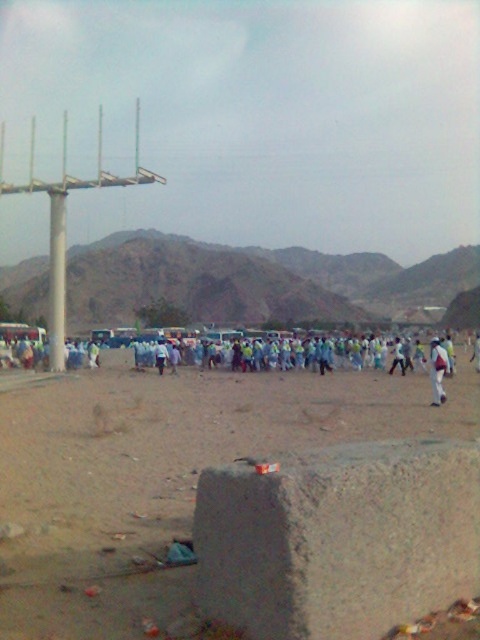
Between brown sandy dirt at center and white concrete pillar at left, which one appears on the left side from the viewer's perspective?

From the viewer's perspective, white concrete pillar at left appears more on the left side.

Find the location of a particular element. brown sandy dirt at center is located at coordinates (164, 476).

Find the location of `brown sandy dirt at center`. brown sandy dirt at center is located at coordinates (164, 476).

Can you confirm if white concrete pillar at left is shorter than white fabric person at center?

Incorrect, white concrete pillar at left's height does not fall short of white fabric person at center's.

Which is more to the right, white concrete pillar at left or white fabric person at center?

white fabric person at center

Is point (61, 310) closer to viewer compared to point (399, 364)?

No.

The width and height of the screenshot is (480, 640). I want to click on white concrete pillar at left, so click(57, 278).

Which is in front, point (62, 346) or point (447, 365)?

Point (447, 365) is more forward.

Does white concrete pillar at left appear on the right side of white fabric person at right?

Incorrect, white concrete pillar at left is not on the right side of white fabric person at right.

Is point (50, 248) more distant than point (444, 365)?

Yes, it is behind point (444, 365).

In order to click on white concrete pillar at left in this screenshot , I will do `click(57, 278)`.